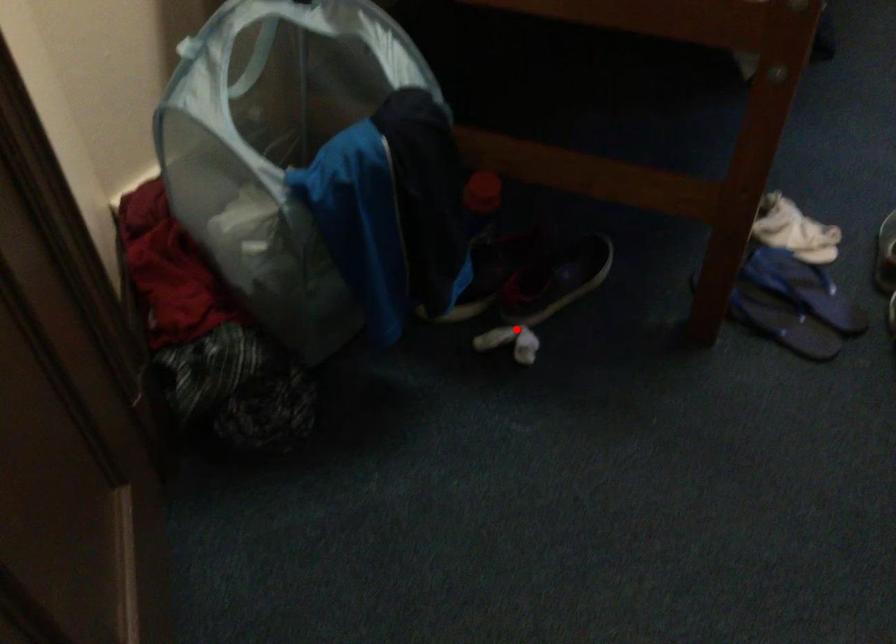
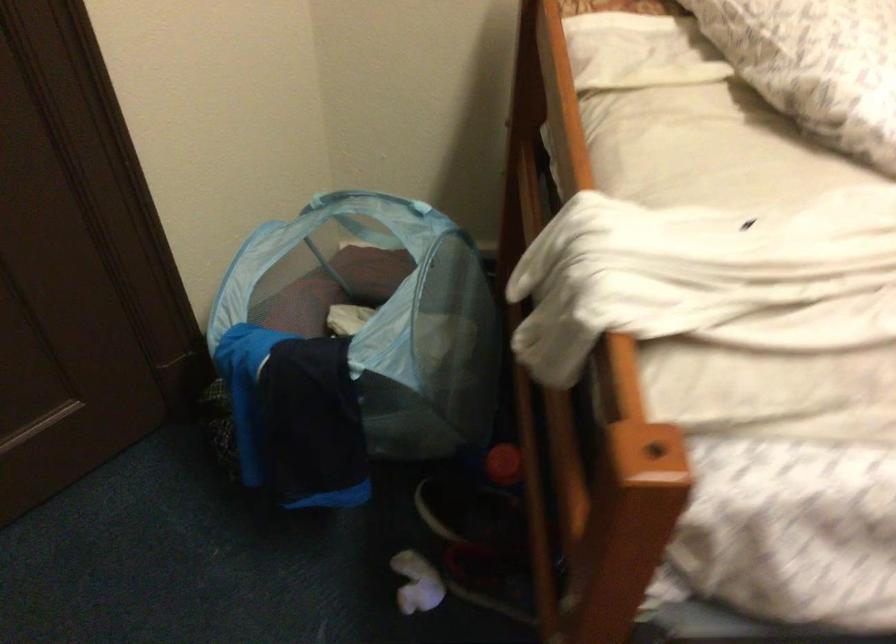
Find the pixel in the second image that matches the highlighted location in the first image.

(417, 583)